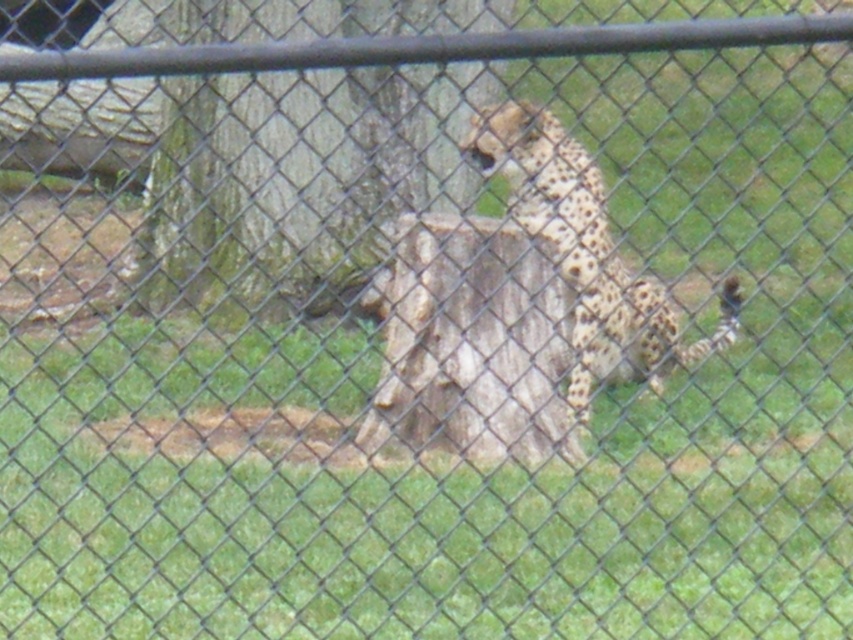
Question: Does rough bark tree stump at center have a lesser width compared to spotted fur cheetah at center?

Choices:
 (A) yes
 (B) no

Answer: (B)

Question: Is rough bark tree stump at center further to camera compared to spotted fur cheetah at center?

Choices:
 (A) yes
 (B) no

Answer: (A)

Question: Is rough bark tree stump at center thinner than spotted fur cheetah at center?

Choices:
 (A) no
 (B) yes

Answer: (A)

Question: Among these points, which one is nearest to the camera?

Choices:
 (A) (317, 129)
 (B) (668, 336)

Answer: (B)

Question: Which point appears farthest from the camera in this image?

Choices:
 (A) (422, 104)
 (B) (585, 349)

Answer: (B)